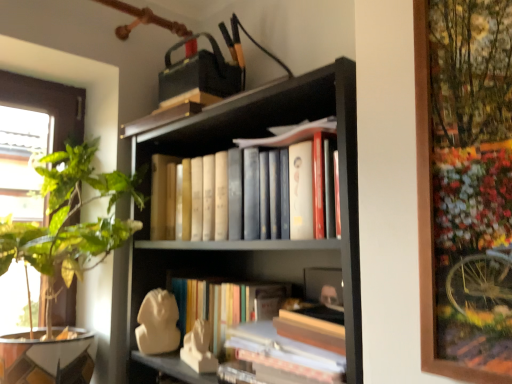
Question: From the image's perspective, is hardcover books at center located above or below matte black bookcase at center?

Choices:
 (A) below
 (B) above

Answer: (B)

Question: From their relative heights in the image, would you say hardcover books at center is taller or shorter than matte black bookcase at center?

Choices:
 (A) short
 (B) tall

Answer: (A)

Question: Which object is positioned farthest from the hardcover books at center?

Choices:
 (A) matte black bookcase at center
 (B) green leafy plant at left

Answer: (B)

Question: Based on their relative distances, which object is nearer to the green leafy plant at left?

Choices:
 (A) matte black bookcase at center
 (B) hardcover books at center

Answer: (B)